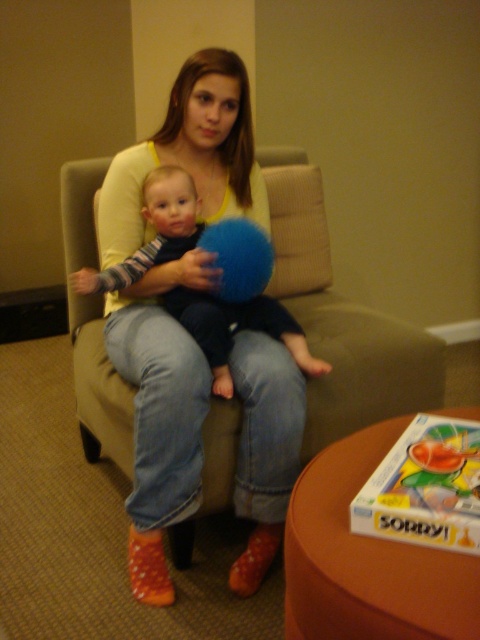
You are a photographer setting up a shoot in this room. You need to place a matte yellow sweater at center and a soft blue plush at center on a shelf that can only hold items up to 1 meter in total width. Can both items fit together on the shelf?

The matte yellow sweater at center is narrower than the soft blue plush at center. Since the total width of both items combined must be under 1 meter, but we don not know their exact widths, it depends on their combined size. However, since the sweater is narrower, there is a possibility they could fit if their combined width is under 1 meter.

You are a photographer setting up for a family photo. You need to ensure that the matte yellow sweater at center and the blue fuzzy ball at center are both visible in the frame. Given their sizes, which object should you focus on to ensure both are in focus?

The matte yellow sweater at center is larger than the blue fuzzy ball at center, so focusing on the sweater will help ensure both objects remain in focus as it is the larger and more prominent object in the scene.

You are a child playing with the soft blue plush at center and the blue fuzzy ball at center. You want to grab the one that is closer to you. Which one should you choose?

The soft blue plush at center is closer to the viewer than the blue fuzzy ball at center, so you should grab the soft blue plush at center.